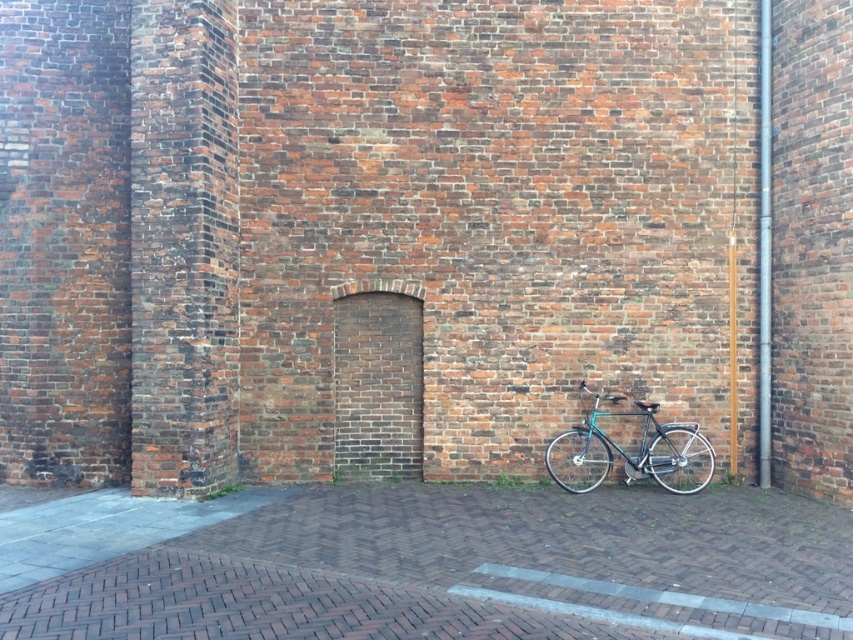
Consider the image. Measure the distance between point [204,612] and camera.

Point [204,612] and camera are 5.32 meters apart from each other.

Can you confirm if brick pavement at lower right is taller than metallic silver pole at right?

Incorrect, brick pavement at lower right's height is not larger of metallic silver pole at right's.

I want to click on brick pavement at lower right, so click(x=425, y=563).

Looking at this image, who is positioned more to the left, silver metallic pole at right or metallic silver pole at right?

From the viewer's perspective, metallic silver pole at right appears more on the left side.

Which of these two, silver metallic pole at right or metallic silver pole at right, stands taller?

With more height is silver metallic pole at right.

Between point (759, 211) and point (735, 384), which one is positioned in front?

Positioned in front is point (759, 211).

You are a GUI agent. You are given a task and a screenshot of the screen. Output one action in this format:
    pyautogui.click(x=<x>, y=<y>)
    Task: Click on the silver metallic pole at right
    
    Given the screenshot: What is the action you would take?
    pyautogui.click(x=764, y=248)

Does brick pavement at lower right come behind teal glossy bicycle at lower right?

No, brick pavement at lower right is closer to the viewer.

Does brick pavement at lower right have a smaller size compared to teal glossy bicycle at lower right?

Indeed, brick pavement at lower right has a smaller size compared to teal glossy bicycle at lower right.

In the scene shown: Who is more forward, (485, 634) or (581, 467)?

Point (485, 634)

The image size is (853, 640). In order to click on brick pavement at lower right in this screenshot , I will do `click(425, 563)`.